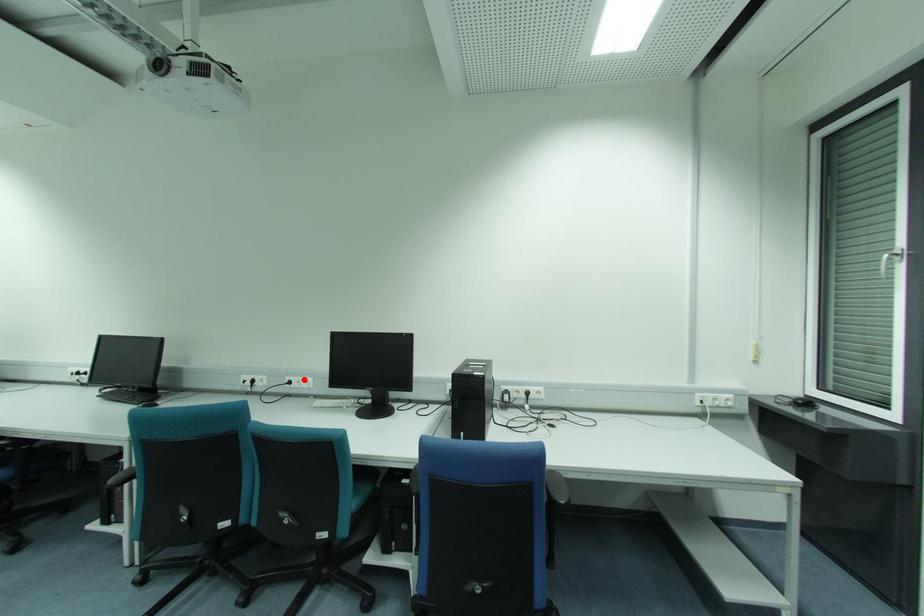
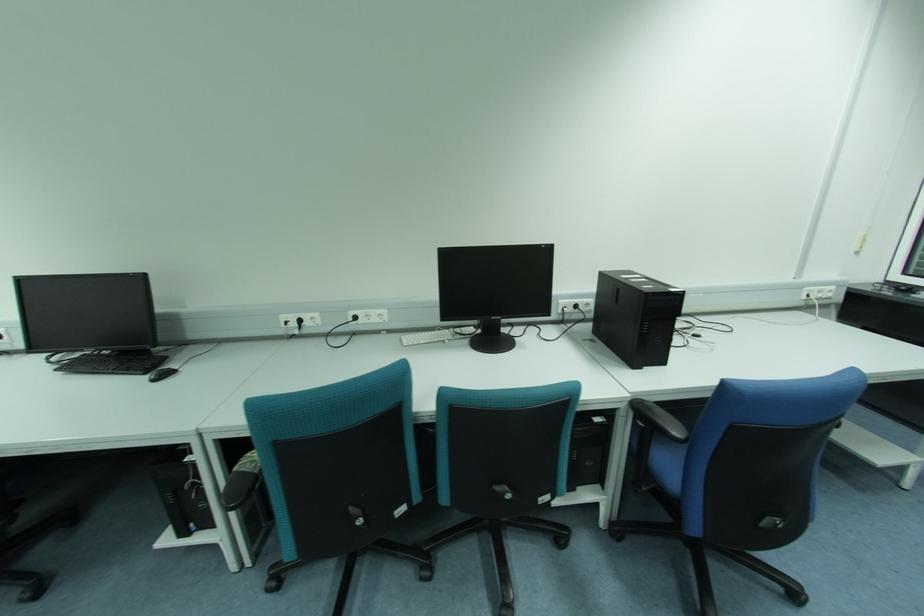
The point at the highlighted location is marked in the first image. Where is the corresponding point in the second image?

(374, 313)